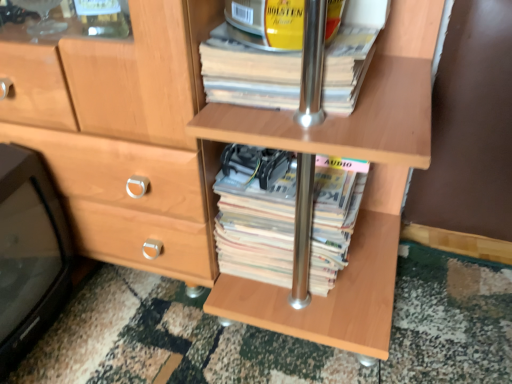
Question: Is white paper at center, the second paperback book viewed from the top, inside the boundaries of black plastic tv at lower left, or outside?

Choices:
 (A) outside
 (B) inside

Answer: (A)

Question: Relative to black plastic tv at lower left, is white paper at center, placed as the 1th paperback book when sorted from bottom to top, in front or behind?

Choices:
 (A) front
 (B) behind

Answer: (B)

Question: Estimate the real-world distances between objects in this image. Which object is closer to the yellow paper at upper center, which is the second paperback book from bottom to top?

Choices:
 (A) white paper at center, placed as the 1th paperback book when sorted from bottom to top
 (B) black plastic tv at lower left

Answer: (A)

Question: Based on their relative distances, which object is farther from the yellow paper at upper center, placed as the 1th paperback book when sorted from top to bottom?

Choices:
 (A) white paper at center, the second paperback book viewed from the top
 (B) black plastic tv at lower left

Answer: (B)